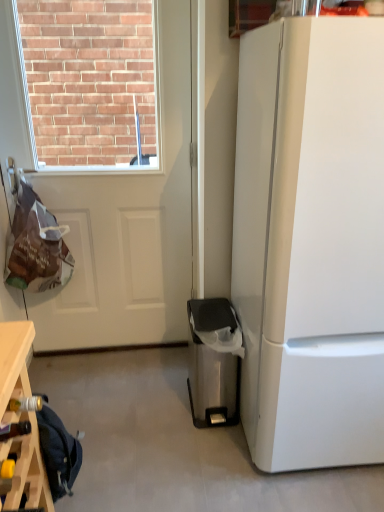
I want to click on empty space that is ontop of stainless steel trash can at lower right (from a real-world perspective), so click(219, 311).